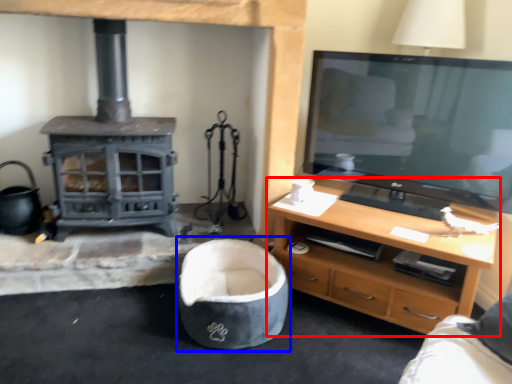
Question: Which point is further to the camera, desk (highlighted by a red box) or bean bag chair (highlighted by a blue box)?

Choices:
 (A) desk
 (B) bean bag chair

Answer: (B)